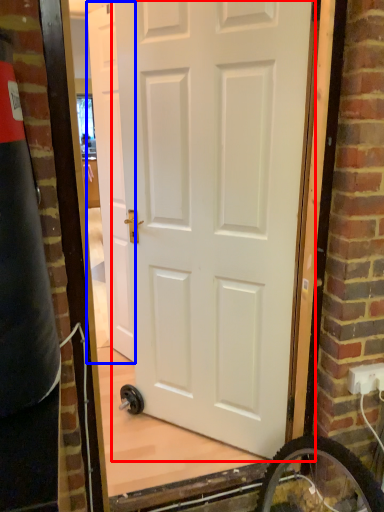
Question: Which point is closer to the camera, door (highlighted by a red box) or door (highlighted by a blue box)?

Choices:
 (A) door
 (B) door

Answer: (A)